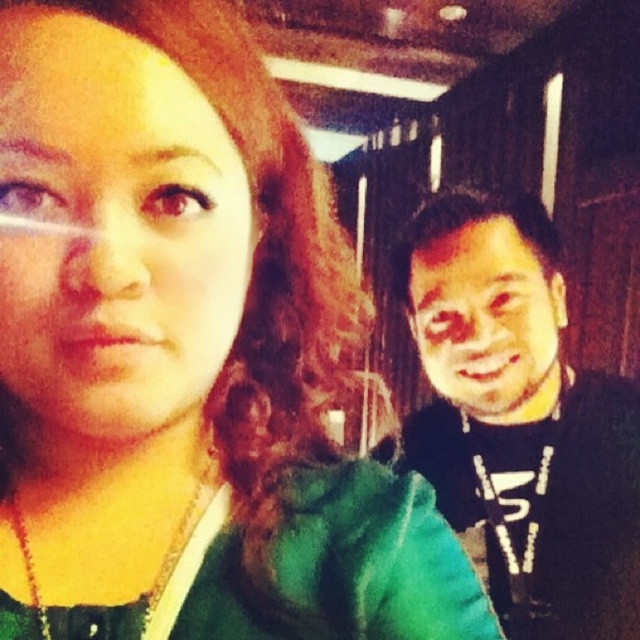
Question: Is matte green shirt at left to the left of smooth skin face at right from the viewer's perspective?

Choices:
 (A) no
 (B) yes

Answer: (B)

Question: Does matte green shirt at left come in front of smooth skin face at right?

Choices:
 (A) no
 (B) yes

Answer: (B)

Question: Which of the following is the closest to the observer?

Choices:
 (A) black matte shirt at right
 (B) smooth skin face at right

Answer: (B)

Question: From the image, what is the correct spatial relationship of matte green shirt at left in relation to black matte shirt at right?

Choices:
 (A) left
 (B) right

Answer: (A)

Question: Which point is farther to the camera?

Choices:
 (A) smooth skin face at right
 (B) black matte shirt at right
 (C) matte green shirt at left

Answer: (B)

Question: Which point is farther to the camera?

Choices:
 (A) smooth skin face at right
 (B) matte green shirt at left
 (C) black matte shirt at right

Answer: (C)